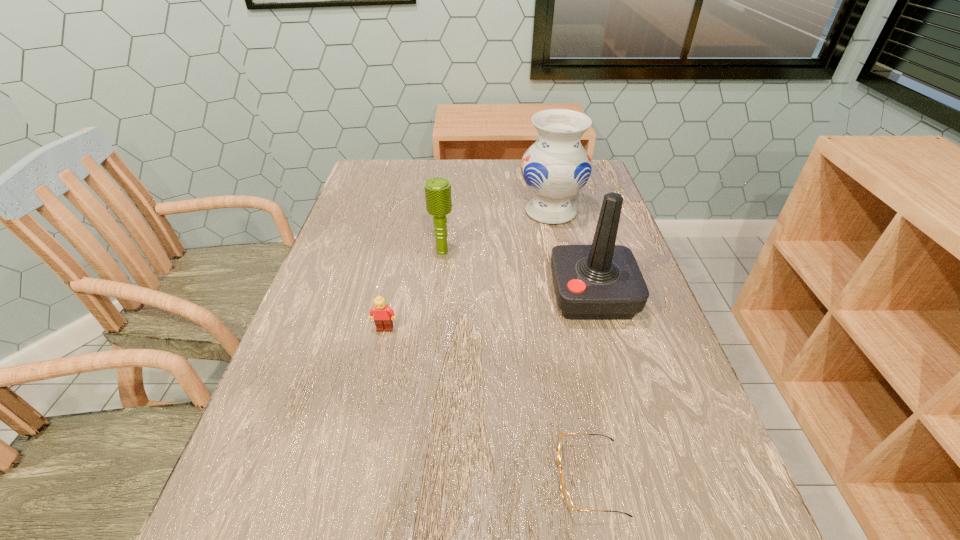
Locate an element on the screen. Image resolution: width=960 pixels, height=540 pixels. free point between the shortest object and the Lego is located at coordinates (488, 403).

Image resolution: width=960 pixels, height=540 pixels. I want to click on free spot between the third shortest object and the vase, so click(496, 232).

Where is `vacant space that's between the nearest object and the joystick`? vacant space that's between the nearest object and the joystick is located at coordinates (591, 387).

The width and height of the screenshot is (960, 540). I want to click on object that is the second closest one to the shortest object, so pos(383,316).

You are a GUI agent. You are given a task and a screenshot of the screen. Output one action in this format:
    pyautogui.click(x=<x>, y=<y>)
    Task: Click on the object that is the closest to the third tallest object
    
    Given the screenshot: What is the action you would take?
    pyautogui.click(x=556, y=167)

This screenshot has height=540, width=960. I want to click on free location that satisfies the following two spatial constraints: 1. on the back side of the second farthest object; 2. on the right side of the vase, so click(x=447, y=212).

Identify the location of free space that satisfies the following two spatial constraints: 1. on the front side of the joystick; 2. on the front-facing side of the nearest object. This screenshot has height=540, width=960. pos(643,477).